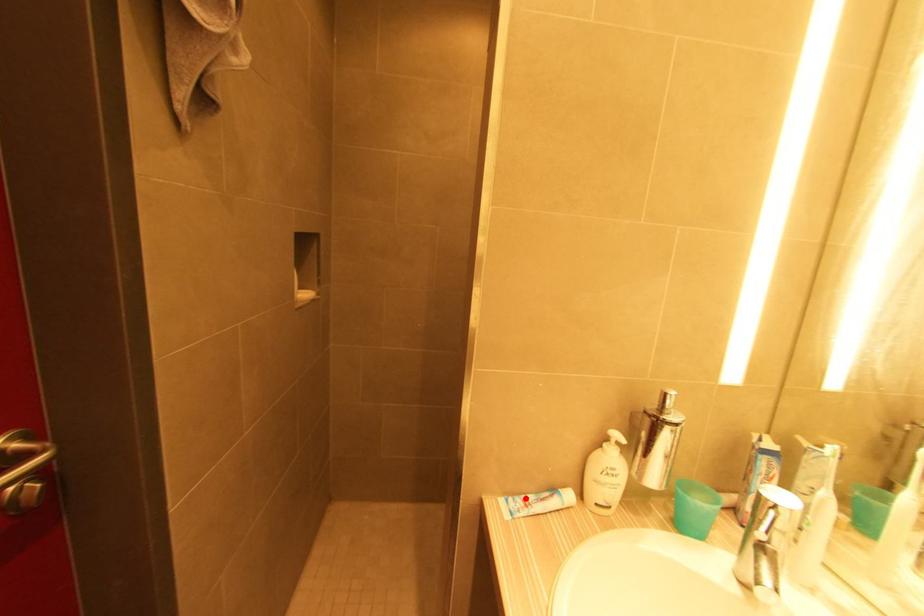
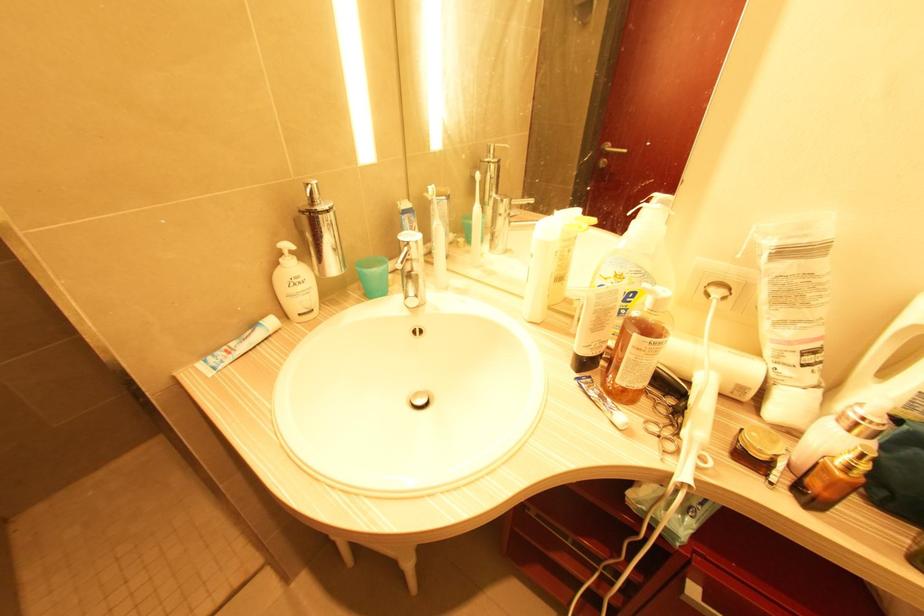
In the second image, find the point that corresponds to the highlighted location in the first image.

(226, 349)